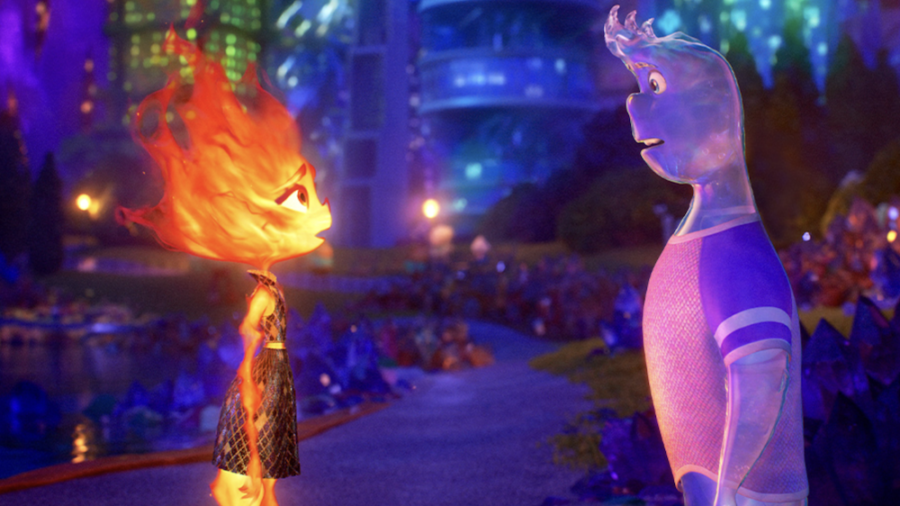
At what (x,y) coordinates should I click in order to perform the action: click on light. Please return your answer as a coordinate pair (x, y). Looking at the image, I should click on (231, 40).